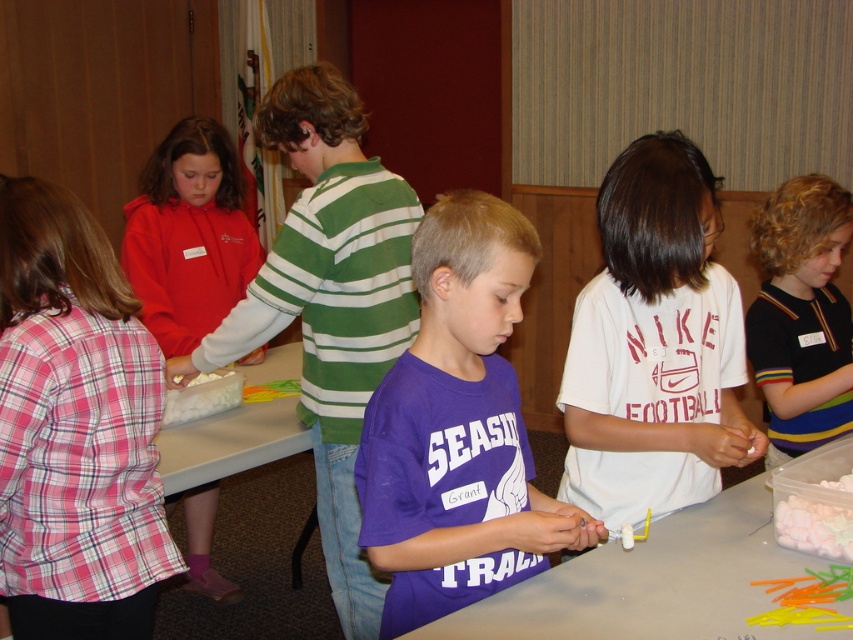
Can you confirm if white plastic table at center is thinner than matte red hoodie at left?

No, white plastic table at center is not thinner than matte red hoodie at left.

Who is more forward, (640, 576) or (223, 227)?

Point (640, 576) is in front.

Between point (570, 572) and point (219, 596), which one is positioned behind?

Positioned behind is point (219, 596).

Locate an element on the screen. The image size is (853, 640). white plastic table at center is located at coordinates (654, 582).

Does point (485, 285) come farther from viewer compared to point (219, 369)?

No.

Who is lower down, purple matte shirt at center or white marshmallow at lower center?

white marshmallow at lower center

What do you see at coordinates (457, 428) in the screenshot? The width and height of the screenshot is (853, 640). I see `purple matte shirt at center` at bounding box center [457, 428].

Locate an element on the screen. The height and width of the screenshot is (640, 853). purple matte shirt at center is located at coordinates (457, 428).

Is white plastic table at center taller than black striped shirt at right?

Incorrect, white plastic table at center's height is not larger of black striped shirt at right's.

Who is lower down, white plastic table at center or black striped shirt at right?

white plastic table at center is below.

Identify the location of white plastic table at center. The height and width of the screenshot is (640, 853). (654, 582).

The height and width of the screenshot is (640, 853). I want to click on white plastic table at center, so click(654, 582).